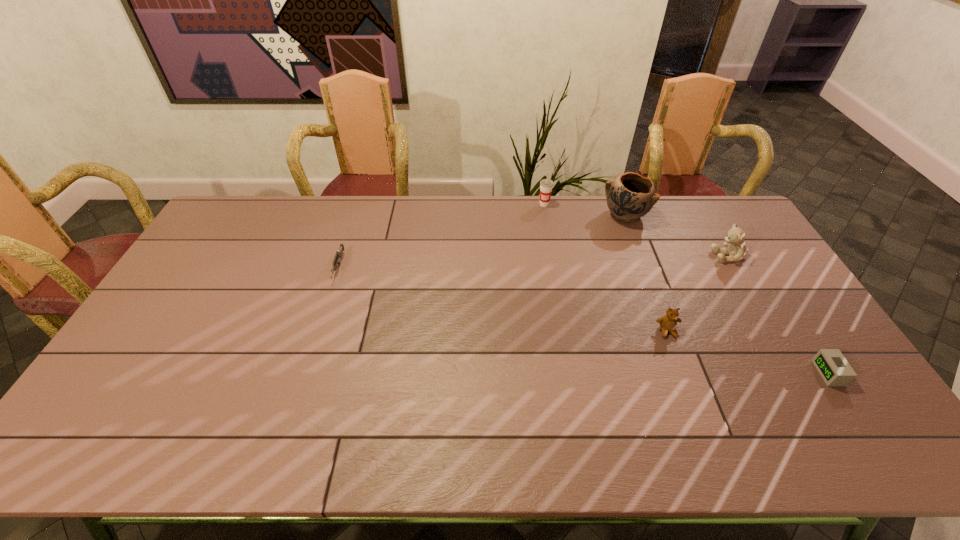
Identify the location of pottery. The image size is (960, 540). (631, 196).

You are a GUI agent. You are given a task and a screenshot of the screen. Output one action in this format:
    pyautogui.click(x=<x>, y=<y>)
    Task: Click on the second object from left to right
    The height and width of the screenshot is (540, 960).
    Given the screenshot: What is the action you would take?
    pyautogui.click(x=546, y=185)

Identify the location of the farther teddy bear. The image size is (960, 540). (736, 250).

Identify the location of the third tallest object. This screenshot has height=540, width=960. (736, 250).

Identify the location of the third shortest object. This screenshot has width=960, height=540. (668, 323).

You are a GUI agent. You are given a task and a screenshot of the screen. Output one action in this format:
    pyautogui.click(x=<x>, y=<y>)
    Task: Click on the nearer teddy bear
    The image size is (960, 540).
    Given the screenshot: What is the action you would take?
    pyautogui.click(x=668, y=323)

Image resolution: width=960 pixels, height=540 pixels. What are the coordinates of `alarm clock` in the screenshot? It's located at (835, 370).

Where is `gun`? The height and width of the screenshot is (540, 960). gun is located at coordinates (336, 263).

Where is `vacant space located 0.140m on the right of the pottery`? This screenshot has height=540, width=960. vacant space located 0.140m on the right of the pottery is located at coordinates 685,215.

Find the location of a particular element. This screenshot has width=960, height=540. free space located 0.220m on the side of the second object from left to right with the logo is located at coordinates (551, 247).